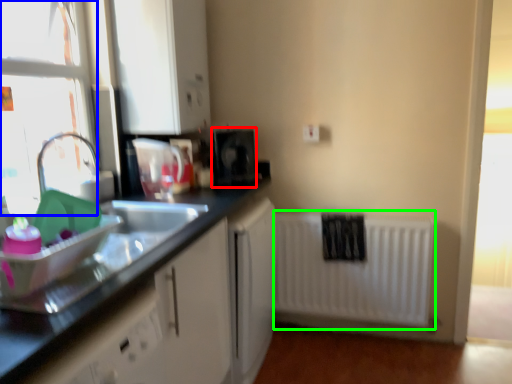
Question: Which object is the farthest from appliance (highlighted by a red box)? Choose among these: window frame (highlighted by a blue box) or radiator (highlighted by a green box).

Choices:
 (A) window frame
 (B) radiator

Answer: (A)